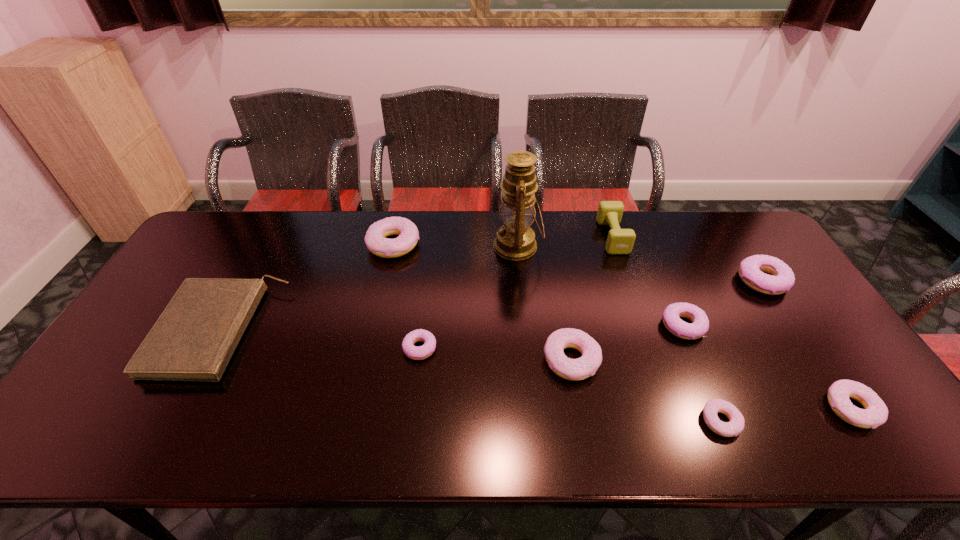
This screenshot has height=540, width=960. Identify the location of the second purple doughnut from right to left. (700, 324).

The image size is (960, 540). What are the coordinates of `the rightmost pink doughnut` in the screenshot? It's located at coord(875,413).

Find the location of `the leftmost purple doughnut`. the leftmost purple doughnut is located at coordinates (422, 352).

I want to click on the third pink doughnut from left to right, so click(736, 425).

Find the location of a particular element. The width and height of the screenshot is (960, 540). free space located 0.310m on the left of the tallest object is located at coordinates (400, 246).

You are a GUI agent. You are given a task and a screenshot of the screen. Output one action in this format:
    pyautogui.click(x=<x>, y=<y>)
    Task: Click on the free location located 0.300m on the front of the dumbbell
    The width and height of the screenshot is (960, 540).
    Given the screenshot: What is the action you would take?
    (643, 327)

The image size is (960, 540). What are the coordinates of `free spot located 0.290m on the left of the biggest pink doughnut` in the screenshot? It's located at (280, 244).

Find the location of a particular element. The width and height of the screenshot is (960, 540). vacant space positioned 0.300m on the left of the sixth nearest doughnut is located at coordinates (639, 281).

Find the location of a particular element. free space located 0.240m on the spine side of the leftmost object is located at coordinates (363, 330).

You are a GUI agent. You are given a task and a screenshot of the screen. Output one action in this format:
    pyautogui.click(x=<x>, y=<y>)
    Task: Click on the free space located on the right of the third pink doughnut from right to left
    This screenshot has width=960, height=540.
    Given the screenshot: What is the action you would take?
    pyautogui.click(x=704, y=360)